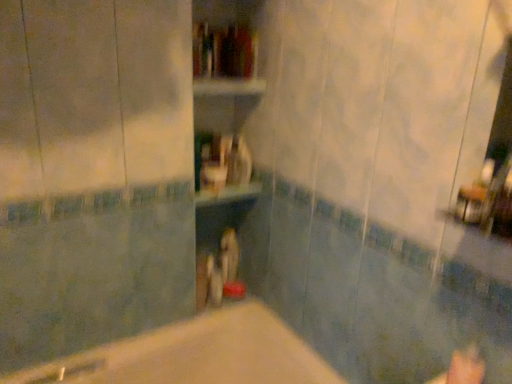
The height and width of the screenshot is (384, 512). What do you see at coordinates (222, 134) in the screenshot? I see `wooden shelf at center` at bounding box center [222, 134].

The width and height of the screenshot is (512, 384). What do you see at coordinates (196, 355) in the screenshot?
I see `beige matte bathtub at center` at bounding box center [196, 355].

The width and height of the screenshot is (512, 384). Find the location of `wooden shelf at center`. wooden shelf at center is located at coordinates (222, 134).

You are a GUI agent. You are given a task and a screenshot of the screen. Output one action in this format:
    pyautogui.click(x=<x>, y=<y>)
    Task: Click on the book that appears behind the beige matte bathtub at center
    The height and width of the screenshot is (384, 512).
    Given the screenshot: What is the action you would take?
    pyautogui.click(x=223, y=51)

Is point (234, 375) positioned behind point (202, 61)?

That is False.

Is beige matte bathtub at center to the left of hardcover book at center from the viewer's perspective?

Yes.

From a real-world perspective, is hardcover book at center below wooden shelf at center?

Incorrect, from a real-world perspective, hardcover book at center is higher than wooden shelf at center.

Between hardcover book at center and wooden shelf at center, which one has smaller width?

Thinner between the two is hardcover book at center.

Looking at this image, from the image's perspective, which one is positioned lower, hardcover book at center or wooden shelf at center?

From the image's view, wooden shelf at center is below.

Find the location of `book on the right of wooden shelf at center`. book on the right of wooden shelf at center is located at coordinates click(223, 51).

Is wooden shelf at center oriented towards beige matte bathtub at center?

No, wooden shelf at center is not aimed at beige matte bathtub at center.

What's the angular difference between wooden shelf at center and beige matte bathtub at center's facing directions?

There is a 0.17-degree angle between the facing directions of wooden shelf at center and beige matte bathtub at center.

Is the depth of wooden shelf at center greater than that of beige matte bathtub at center?

That is True.

Does point (195, 28) come in front of point (186, 323)?

Yes, point (195, 28) is closer to viewer.

Considering the positions of points (217, 342) and (215, 55), is point (217, 342) closer to camera compared to point (215, 55)?

That is False.

Which is more to the right, beige matte bathtub at center or wooden shelf at center?

Positioned to the right is wooden shelf at center.

Is beige matte bathtub at center aimed at wooden shelf at center?

No.

Is wooden shelf at center facing away from hardcover book at center?

Yes.

Does wooden shelf at center have a greater width compared to hardcover book at center?

Yes, wooden shelf at center is wider than hardcover book at center.

Which of these two, wooden shelf at center or hardcover book at center, is bigger?

wooden shelf at center.

In the image, is wooden shelf at center positioned in front of or behind hardcover book at center?

Visually, wooden shelf at center is located in front of hardcover book at center.

Which object is more forward, hardcover book at center or beige matte bathtub at center?

beige matte bathtub at center is more forward.

Which point is more distant from viewer, (203, 62) or (256, 383)?

Positioned behind is point (203, 62).

Is hardcover book at center not near beige matte bathtub at center?

Indeed, hardcover book at center is not near beige matte bathtub at center.

The height and width of the screenshot is (384, 512). Identify the location of book above the beige matte bathtub at center (from a real-world perspective). [223, 51].

Image resolution: width=512 pixels, height=384 pixels. I want to click on book that appears above the wooden shelf at center (from the image's perspective), so click(x=223, y=51).

Based on the photo, from the image, which object appears to be nearer to hardcover book at center, beige matte bathtub at center or wooden shelf at center?

wooden shelf at center is closer to hardcover book at center.

Considering their positions, is hardcover book at center positioned closer to wooden shelf at center than beige matte bathtub at center?

Based on the image, hardcover book at center appears to be nearer to wooden shelf at center.

Considering their positions, is wooden shelf at center positioned closer to beige matte bathtub at center than hardcover book at center?

wooden shelf at center lies closer to beige matte bathtub at center than the other object.

From the image, which object appears to be nearer to hardcover book at center, wooden shelf at center or beige matte bathtub at center?

Based on the image, wooden shelf at center appears to be nearer to hardcover book at center.

Looking at the image, which one is located further to wooden shelf at center, beige matte bathtub at center or hardcover book at center?

The object further to wooden shelf at center is beige matte bathtub at center.

Considering their positions, is hardcover book at center positioned closer to beige matte bathtub at center than wooden shelf at center?

Among the two, wooden shelf at center is located nearer to beige matte bathtub at center.

Identify the location of bookshelf between hardcover book at center and beige matte bathtub at center vertically. The image size is (512, 384). (222, 134).